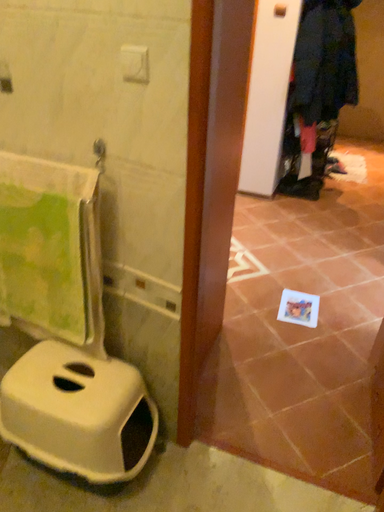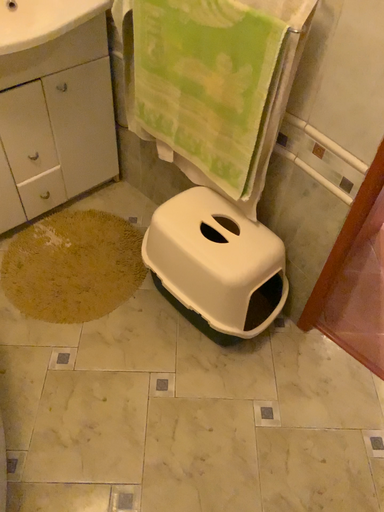
Question: Which way did the camera rotate in the video?

Choices:
 (A) rotated left
 (B) rotated right

Answer: (A)